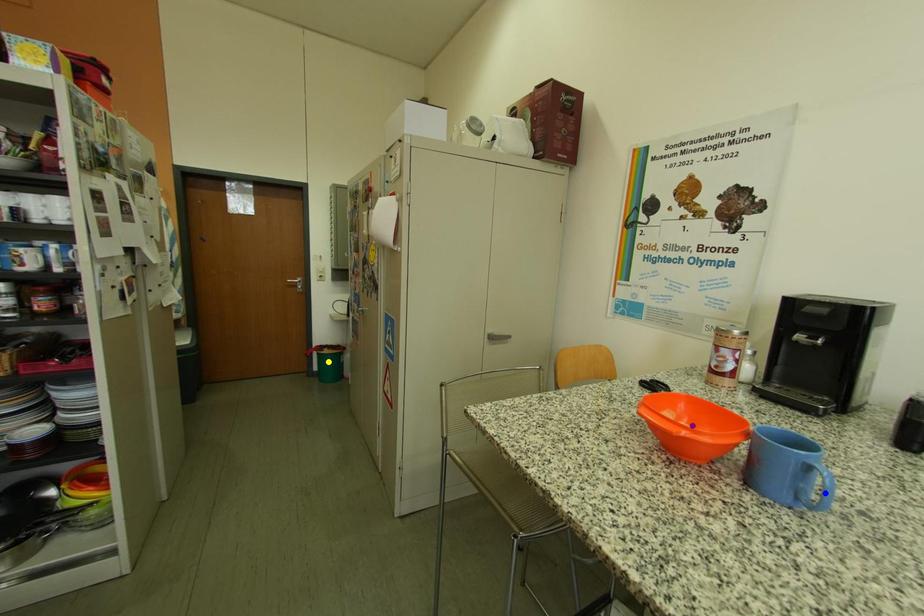
Order these from farthest to nearest:
A) purple point
B) yellow point
C) blue point

1. yellow point
2. purple point
3. blue point